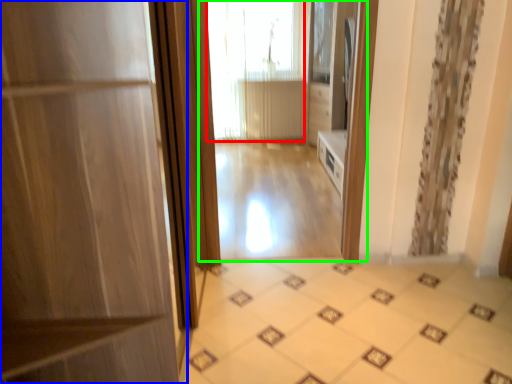
Question: Based on their relative distances, which object is nearer to window (highlighted by a red box)? Choose from door (highlighted by a blue box) and residence (highlighted by a green box).

Choices:
 (A) door
 (B) residence

Answer: (B)